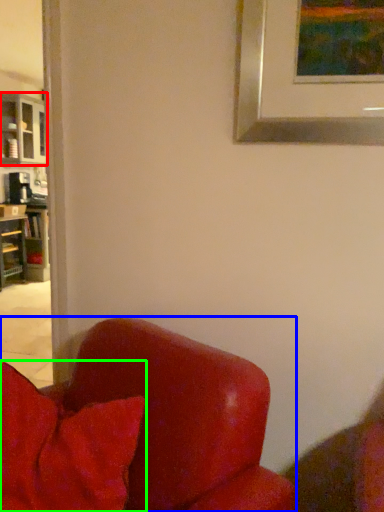
Question: Which object is the closest to the cabinetry (highlighted by a red box)? Choose among these: chair (highlighted by a blue box) or pillow (highlighted by a green box).

Choices:
 (A) chair
 (B) pillow

Answer: (B)